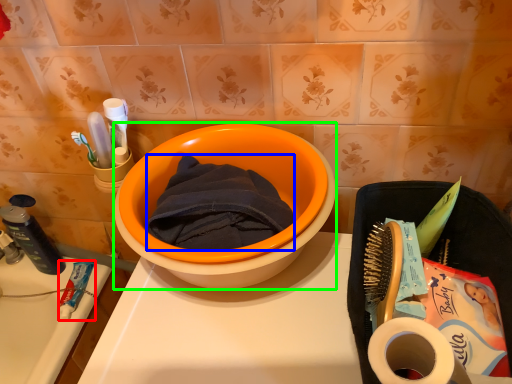
Question: Based on their relative distances, which object is farther from stationery (highlighted by a red box)? Choose from bath towel (highlighted by a blue box) and basin (highlighted by a green box).

Choices:
 (A) bath towel
 (B) basin

Answer: (B)